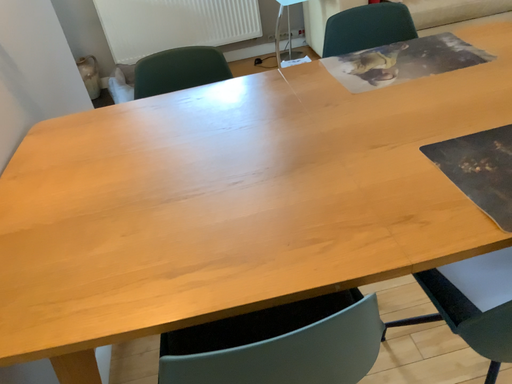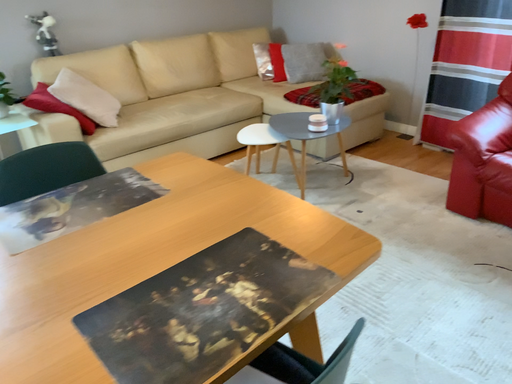
Question: How did the camera likely rotate when shooting the video?

Choices:
 (A) rotated right
 (B) rotated left

Answer: (A)